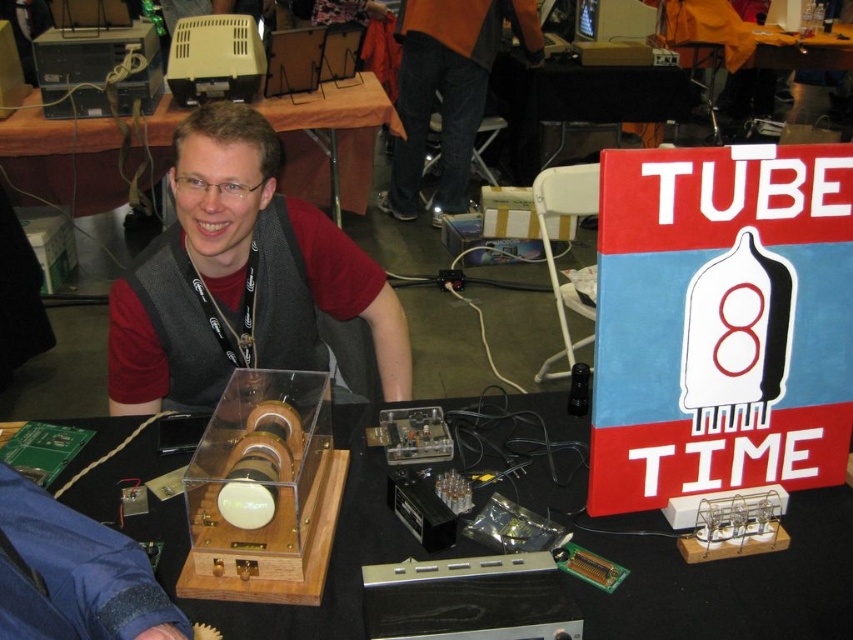
Which is more to the right, transparent plastic table at center or gray fabric vest at upper left?

transparent plastic table at center

Does transparent plastic table at center appear over gray fabric vest at upper left?

No, transparent plastic table at center is not above gray fabric vest at upper left.

At what (x,y) coordinates should I click in order to perform the action: click on transparent plastic table at center. Please return your answer as a coordinate pair (x, y). The image size is (853, 640). Looking at the image, I should click on tap(677, 550).

The width and height of the screenshot is (853, 640). What are the coordinates of `transparent plastic table at center` in the screenshot? It's located at (677, 550).

The image size is (853, 640). I want to click on transparent plastic table at center, so click(x=677, y=550).

Can you confirm if transparent plastic table at center is positioned to the left of orange fabric at upper center?

Yes, transparent plastic table at center is to the left of orange fabric at upper center.

The width and height of the screenshot is (853, 640). What do you see at coordinates (677, 550) in the screenshot?
I see `transparent plastic table at center` at bounding box center [677, 550].

At what (x,y) coordinates should I click in order to perform the action: click on transparent plastic table at center. Please return your answer as a coordinate pair (x, y). This screenshot has width=853, height=640. Looking at the image, I should click on (677, 550).

Does point (235, 161) come farther from viewer compared to point (490, 48)?

No, (235, 161) is closer to viewer.

Can you confirm if gray fabric vest at upper left is wider than orange fabric at upper center?

No, gray fabric vest at upper left is not wider than orange fabric at upper center.

Does point (260, 362) come in front of point (461, 168)?

Yes.

The width and height of the screenshot is (853, 640). What are the coordinates of `gray fabric vest at upper left` in the screenshot? It's located at (273, 248).